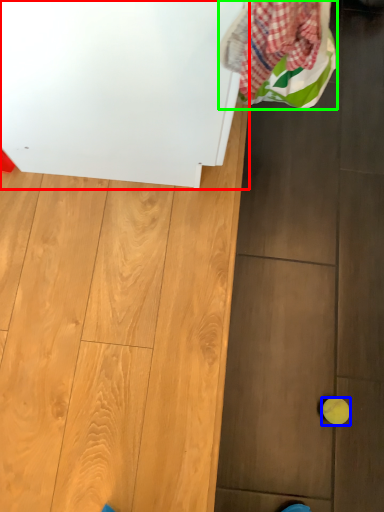
Question: Estimate the real-world distances between objects in this image. Which object is farther from appliance (highlighted by a red box), ball (highlighted by a blue box) or laundry (highlighted by a green box)?

Choices:
 (A) ball
 (B) laundry

Answer: (A)